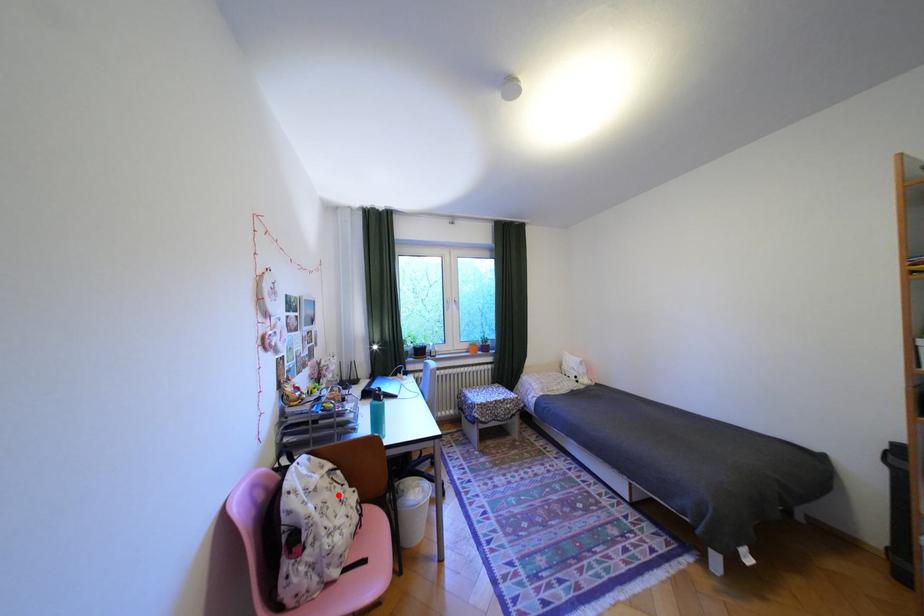
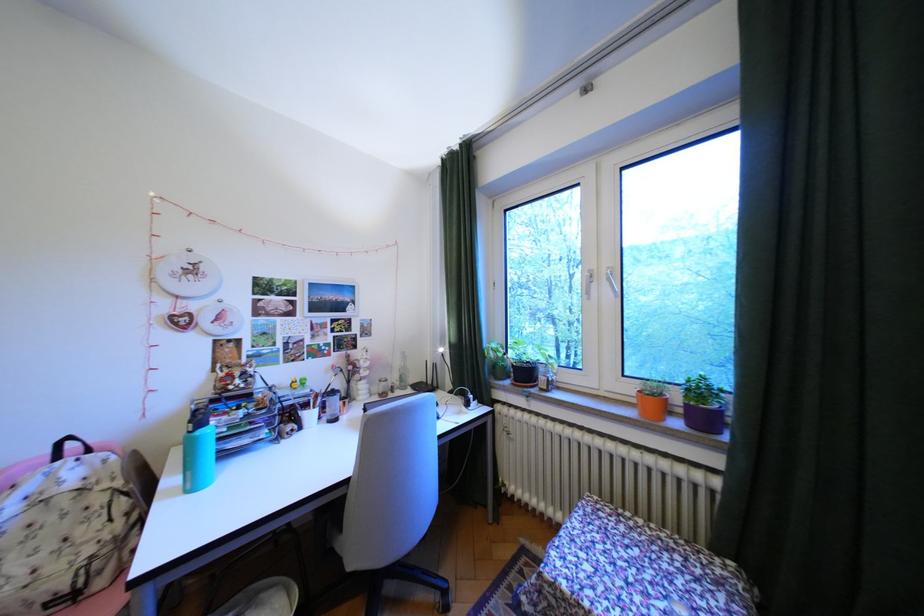
Question: A red point is marked in image1. In image2, is the corresponding 3D point closer to the camera or farther? Reply with the corresponding letter.

Choices:
 (A) The corresponding 3D point is closer.
 (B) The corresponding 3D point is farther.

Answer: (A)